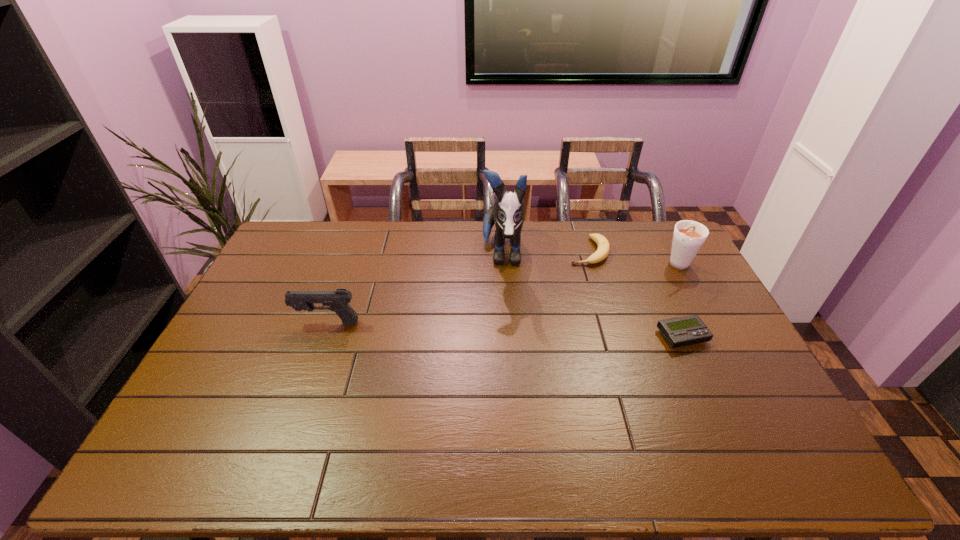
You are a GUI agent. You are given a task and a screenshot of the screen. Output one action in this format:
    pyautogui.click(x=<x>, y=<y>)
    Task: Click on the vacant area situated on the front of the beeper
    This screenshot has height=540, width=960.
    Given the screenshot: What is the action you would take?
    pyautogui.click(x=708, y=393)

Image resolution: width=960 pixels, height=540 pixels. I want to click on free region located 0.200m on the front-facing side of the fourth object from right to left, so click(x=502, y=330).

Image resolution: width=960 pixels, height=540 pixels. I want to click on vacant region located on the front-facing side of the fourth object from right to left, so click(500, 384).

Where is `vacant space located on the front-facing side of the fourth object from right to left`? vacant space located on the front-facing side of the fourth object from right to left is located at coordinates (502, 340).

Where is `vacant space located at the stem of the third object from right to left`? Image resolution: width=960 pixels, height=540 pixels. vacant space located at the stem of the third object from right to left is located at coordinates (554, 324).

I want to click on vacant space situated at the stem of the third object from right to left, so click(x=574, y=284).

Identify the location of vacant space located 0.340m at the stem of the third object from right to left. The width and height of the screenshot is (960, 540). (552, 328).

At what (x,y) coordinates should I click in order to perform the action: click on free space located 0.120m on the drink side of the root beer. Please return your answer as a coordinate pair (x, y). This screenshot has width=960, height=540. Looking at the image, I should click on point(644,284).

Image resolution: width=960 pixels, height=540 pixels. I want to click on free space located 0.180m on the drink side of the root beer, so click(632, 290).

This screenshot has width=960, height=540. I want to click on vacant region located on the drink side of the root beer, so click(600, 307).